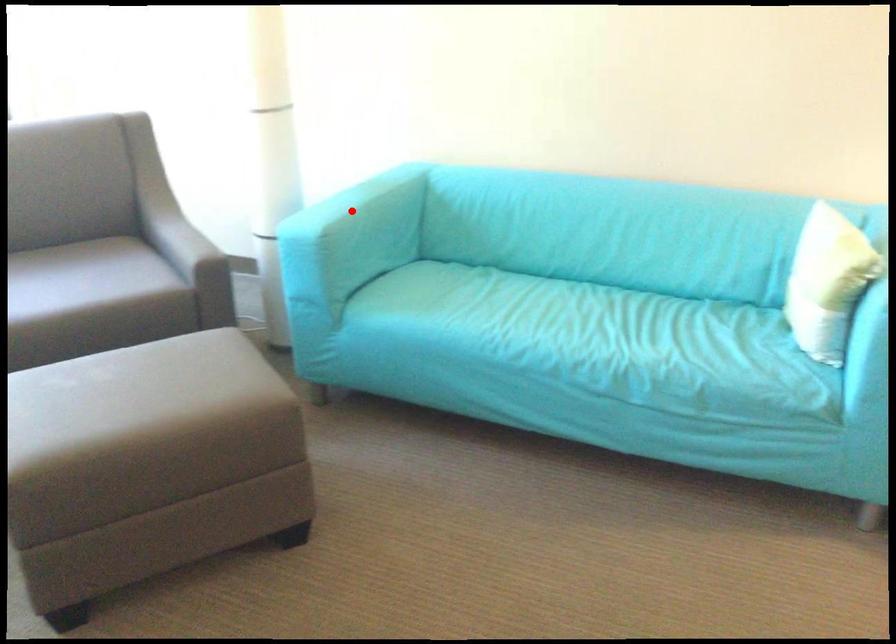
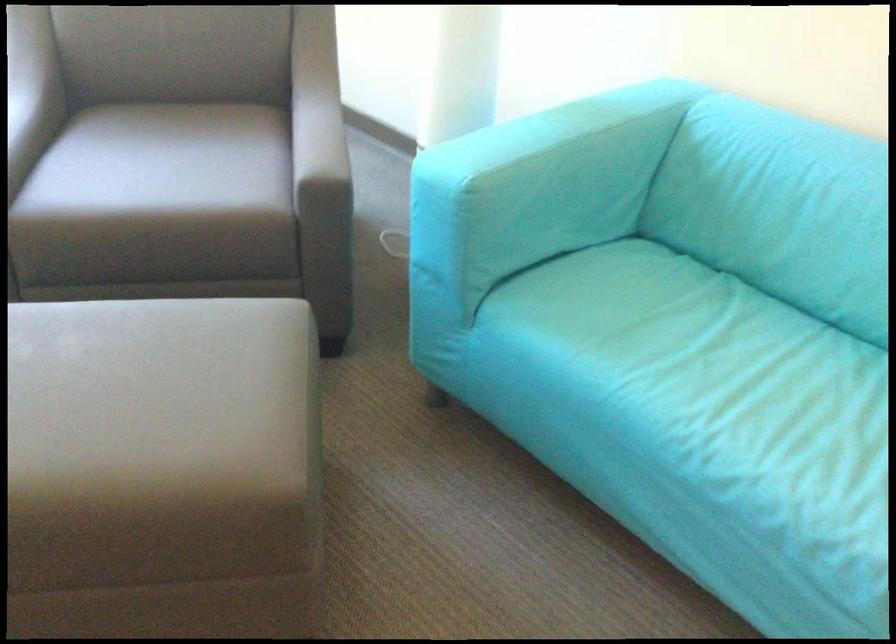
The point at the highlighted location is marked in the first image. Where is the corresponding point in the second image?

(554, 162)